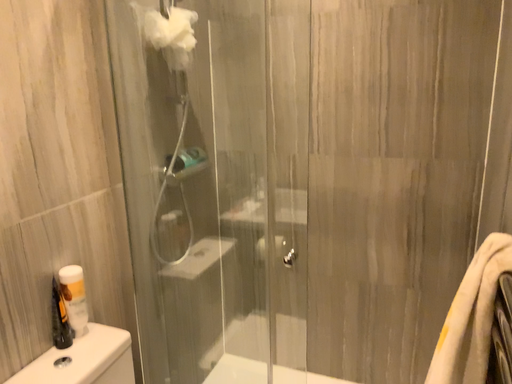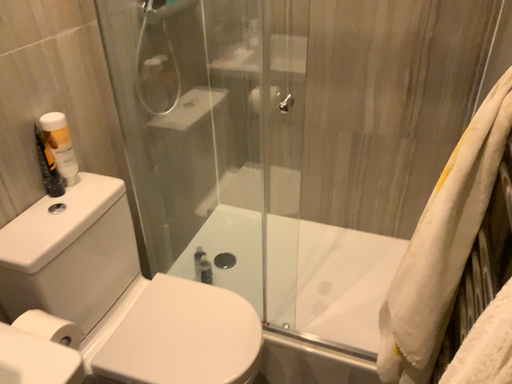
Question: How did the camera likely rotate when shooting the video?

Choices:
 (A) rotated upward
 (B) rotated downward

Answer: (B)